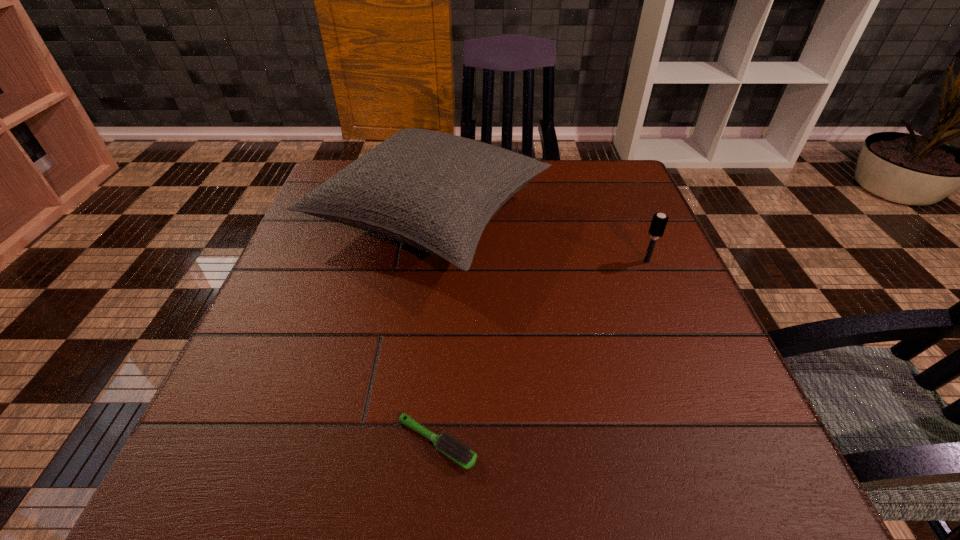
Locate an element on the screen. This screenshot has width=960, height=540. vacant area that lies between the farther hairbrush and the cushion is located at coordinates (539, 240).

Where is `free space between the rightmost object and the left hairbrush`? free space between the rightmost object and the left hairbrush is located at coordinates (541, 353).

Find the location of a particular element. This screenshot has height=540, width=960. free spot between the shorter hairbrush and the tallest object is located at coordinates (434, 330).

In order to click on vacant area that lies between the cushion and the shorter hairbrush in this screenshot , I will do `click(434, 330)`.

This screenshot has height=540, width=960. I want to click on blank region between the tallest object and the taller hairbrush, so click(539, 240).

Where is `empty space that is in between the rightmost object and the cushion`? The image size is (960, 540). empty space that is in between the rightmost object and the cushion is located at coordinates (539, 240).

This screenshot has height=540, width=960. I want to click on free space between the tallest object and the second tallest object, so click(539, 240).

Locate an element on the screen. Image resolution: width=960 pixels, height=540 pixels. vacant space that's between the tallest object and the taller hairbrush is located at coordinates (539, 240).

Where is `object that is the second nearest to the taller hairbrush`? object that is the second nearest to the taller hairbrush is located at coordinates (462, 455).

At what (x,y) coordinates should I click in order to perform the action: click on the closest object to the cushion. Please return your answer as a coordinate pair (x, y). The height and width of the screenshot is (540, 960). Looking at the image, I should click on (659, 221).